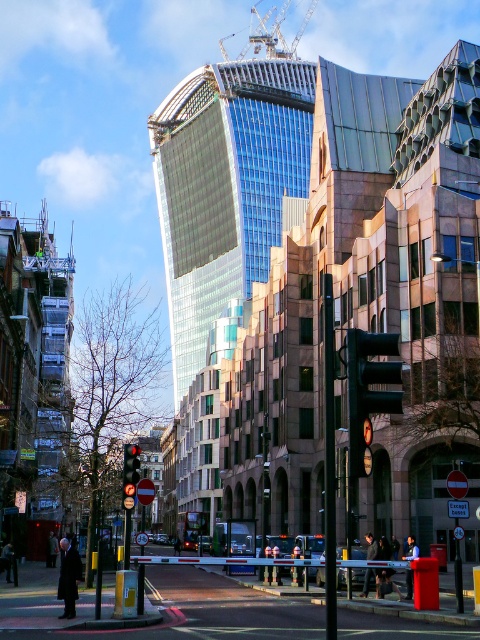
From the picture: Looking at the urban street scene, there is a point marked at coordinates [226,188]. What object is located at this point?

The point at [226,188] is where the glassy reflective skyscraper at center is located.

You are standing at the camera position looking at the urban street scene. There is a point marked at coordinates point [392,404]. Can you reach this point without moving your position? Explain why or why not.

The point [392,404] is 96.46 feet away from the camera. Since this distance is quite large, you cannot physically reach it without moving from your current position.

You are a pedestrian standing on the sidewalk and want to take a photo of the glassy reflective skyscraper at center without the red glass traffic light at center blocking the view. Is the traffic light in front of or behind the skyscraper?

The glassy reflective skyscraper at center is further to the viewer than the red glass traffic light at center, so the traffic light is behind the skyscraper and won